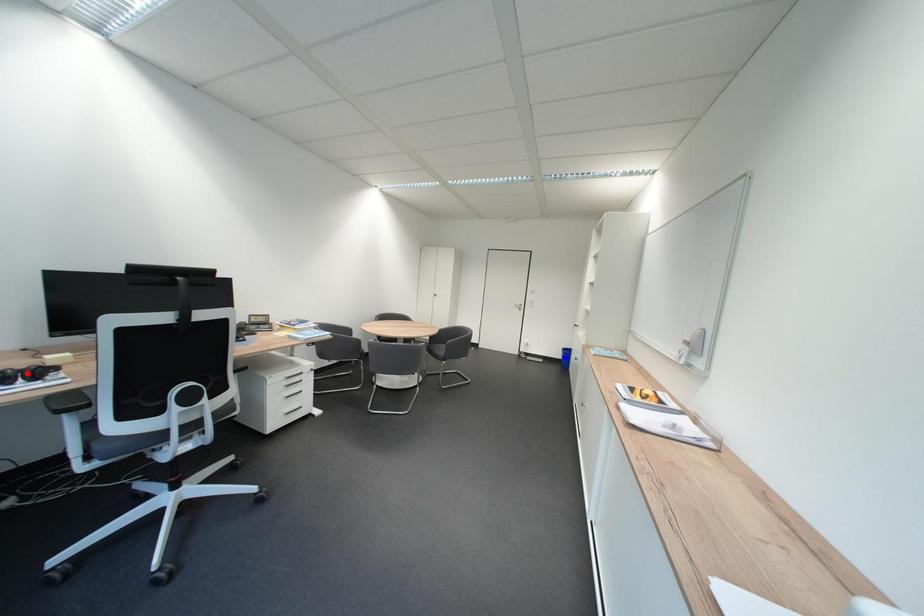
Question: In the image, two points are highlighted. Which point is nearer to the camera? Reply with the corresponding letter.

Choices:
 (A) blue point
 (B) red point

Answer: (B)